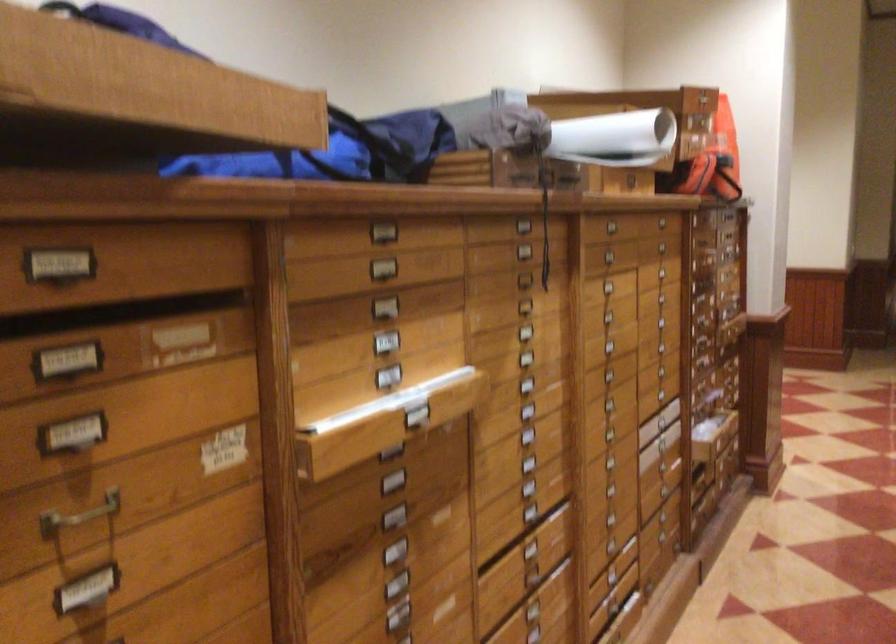
This screenshot has width=896, height=644. Describe the element at coordinates (416, 411) in the screenshot. I see `the metal drawer handle` at that location.